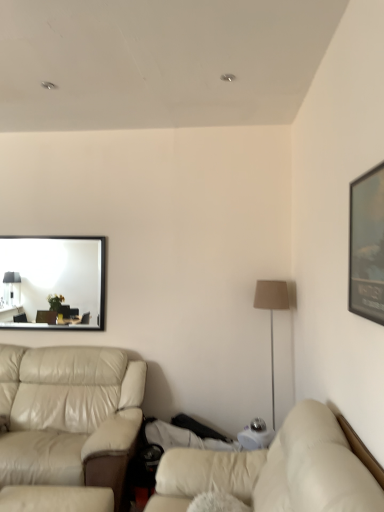
Question: Should I look upward or downward to see beige leather studio couch at left, arranged as the second studio couch when viewed from the front?

Choices:
 (A) up
 (B) down

Answer: (B)

Question: Does beige leather studio couch at left, acting as the first studio couch starting from the left, turn towards matte black mirror at upper left?

Choices:
 (A) no
 (B) yes

Answer: (A)

Question: Is beige leather studio couch at left, the 2th studio couch in the right-to-left sequence, positioned with its back to matte black mirror at upper left?

Choices:
 (A) no
 (B) yes

Answer: (A)

Question: Can matte black mirror at upper left be found inside beige leather studio couch at left, the 2th studio couch in the right-to-left sequence?

Choices:
 (A) no
 (B) yes

Answer: (A)

Question: Is there a large distance between beige leather studio couch at left, the 2th studio couch in the right-to-left sequence, and matte black mirror at upper left?

Choices:
 (A) yes
 (B) no

Answer: (A)

Question: Considering the relative sizes of beige leather studio couch at left, positioned as the first studio couch in back-to-front order, and matte black mirror at upper left in the image provided, is beige leather studio couch at left, positioned as the first studio couch in back-to-front order, wider than matte black mirror at upper left?

Choices:
 (A) yes
 (B) no

Answer: (A)

Question: Considering the relative sizes of beige leather studio couch at left, arranged as the second studio couch when viewed from the front, and matte black mirror at upper left in the image provided, is beige leather studio couch at left, arranged as the second studio couch when viewed from the front, bigger than matte black mirror at upper left?

Choices:
 (A) no
 (B) yes

Answer: (B)

Question: From the image's perspective, is matte black picture frame at upper right beneath beige leather couch at lower right, which is the second studio couch from back to front?

Choices:
 (A) no
 (B) yes

Answer: (A)

Question: Does matte black picture frame at upper right have a lesser width compared to beige leather couch at lower right, arranged as the 1th studio couch when viewed from the front?

Choices:
 (A) yes
 (B) no

Answer: (A)

Question: Could you tell me if matte black picture frame at upper right is turned towards beige leather couch at lower right, arranged as the second studio couch when viewed from the left?

Choices:
 (A) yes
 (B) no

Answer: (B)

Question: Does matte black picture frame at upper right appear on the right side of beige leather couch at lower right, which is the 1th studio couch from right to left?

Choices:
 (A) no
 (B) yes

Answer: (B)

Question: Is the depth of matte black picture frame at upper right less than that of beige leather couch at lower right, arranged as the second studio couch when viewed from the left?

Choices:
 (A) no
 (B) yes

Answer: (A)

Question: From the image's perspective, would you say matte black picture frame at upper right is positioned over beige leather couch at lower right, arranged as the second studio couch when viewed from the left?

Choices:
 (A) yes
 (B) no

Answer: (A)

Question: Can matte black mirror at upper left be found inside matte black picture frame at upper right?

Choices:
 (A) no
 (B) yes

Answer: (A)